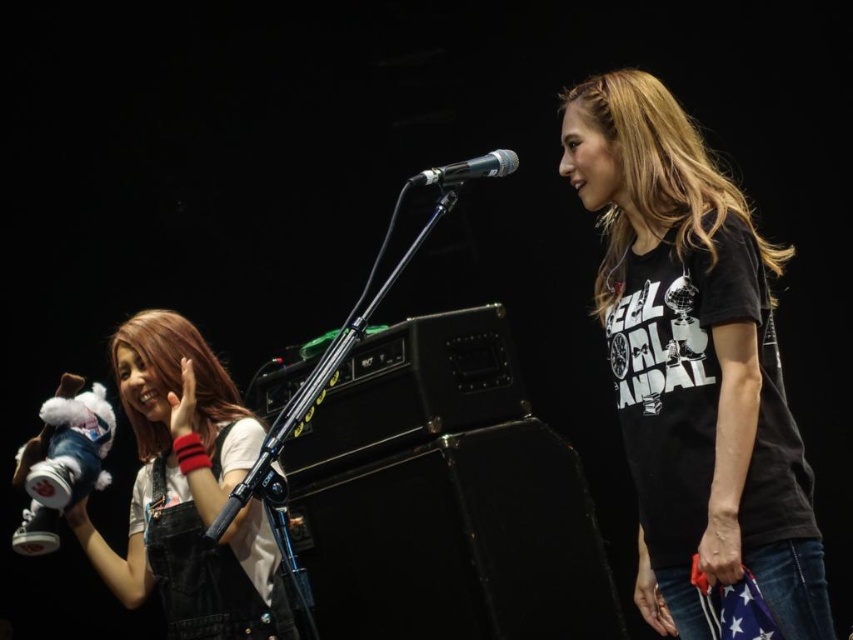
You are a photographer adjusting your camera to focus on two points in the scene. The first point is at coordinates point (161, 493) and the second point is at point (500, 164). Which point should you focus on first if you want to capture the closest object to the camera?

You should focus on point (161, 493) first because it is closer to the camera than point (500, 164).

You are a stagehand responsible for setting up equipment. You notice the white plush toy at left and the metallic silver microphone at center on stage. The safety guidelines require that all handheld items must be at least 40 inches apart to avoid interference during performances. Are these two items compliant with the safety guidelines?

The white plush toy at left and the metallic silver microphone at center are 38.21 inches apart from each other, which is less than the required 40 inches. Therefore, they are not compliant with the safety guidelines.